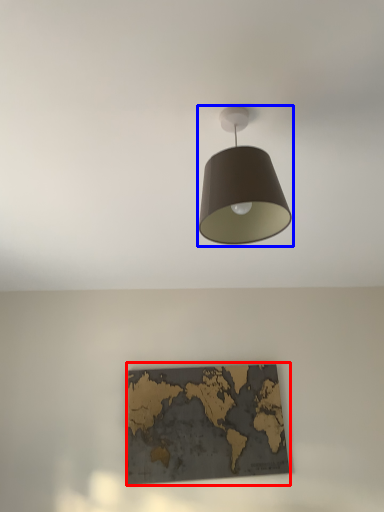
Question: Which point is further to the camera, picture frame (highlighted by a red box) or lamp (highlighted by a blue box)?

Choices:
 (A) picture frame
 (B) lamp

Answer: (A)